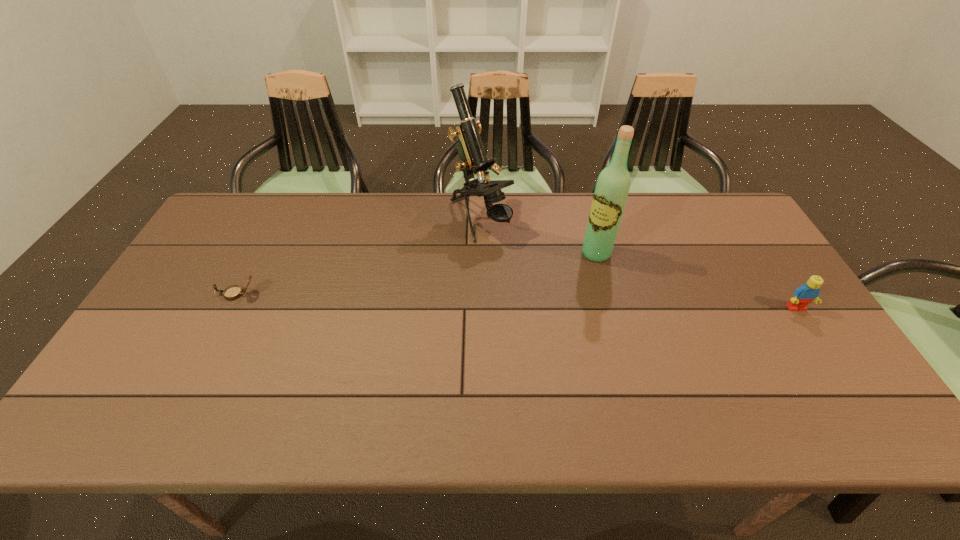
Identify the location of vacant space at the near edge of the desktop. Image resolution: width=960 pixels, height=540 pixels. (441, 364).

At what (x,y) coordinates should I click in order to perform the action: click on free space at the left edge. Please return your answer as a coordinate pair (x, y). Image resolution: width=960 pixels, height=540 pixels. Looking at the image, I should click on (186, 284).

This screenshot has width=960, height=540. In the image, there is a desktop. Find the location of `vacant space at the right edge`. vacant space at the right edge is located at coordinates (753, 242).

The height and width of the screenshot is (540, 960). In the image, there is a desktop. In order to click on free space at the near left corner in this screenshot , I will do `click(123, 362)`.

At what (x,y) coordinates should I click in order to perform the action: click on vacant region at the far right corner of the desktop. Please return your answer as a coordinate pair (x, y). Looking at the image, I should click on (748, 232).

Where is `blank region between the wine bottle and the third farthest object`? The image size is (960, 540). blank region between the wine bottle and the third farthest object is located at coordinates tap(417, 274).

What are the coordinates of `free area in between the microscope and the wine bottle` in the screenshot? It's located at (538, 237).

Find the location of a particular element. vacant space that is in between the compass and the wine bottle is located at coordinates (417, 274).

Locate an element on the screen. Image resolution: width=960 pixels, height=540 pixels. vacant space in between the wine bottle and the microscope is located at coordinates (538, 237).

Find the location of a particular element. The height and width of the screenshot is (540, 960). empty location between the third tallest object and the third object from left to right is located at coordinates (696, 281).